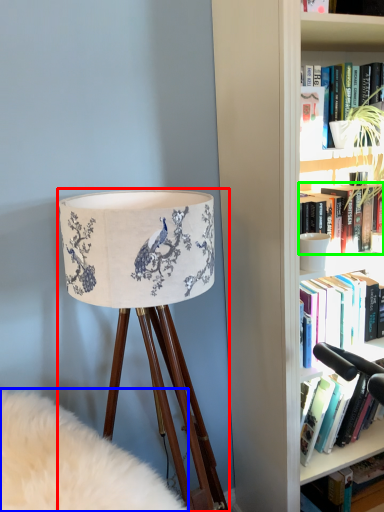
Question: Which object is positioned closest to lamp (highlighted by a red box)? Select from plain (highlighted by a blue box) and book (highlighted by a green box).

Choices:
 (A) plain
 (B) book

Answer: (A)